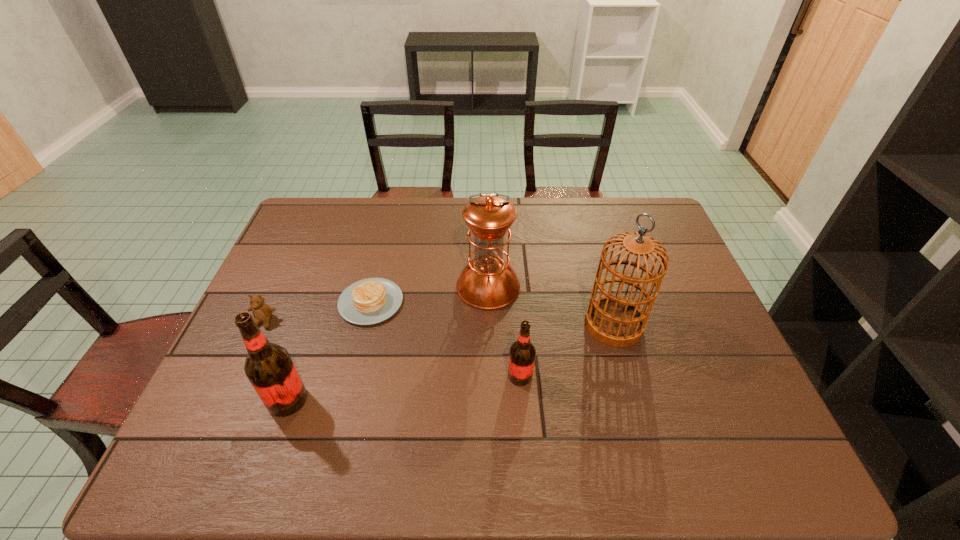
Identify the location of vacant space located on the back of the taller root beer. (330, 279).

The height and width of the screenshot is (540, 960). Identify the location of vacant point located 0.050m on the right of the right root beer. (553, 376).

The width and height of the screenshot is (960, 540). In order to click on blank space located on the back of the shortest object in this screenshot , I will do `click(389, 230)`.

This screenshot has width=960, height=540. I want to click on vacant space located on the front-facing side of the leftmost object, so click(245, 363).

This screenshot has width=960, height=540. I want to click on vacant space situated 0.190m on the left of the rightmost object, so click(516, 324).

Identify the location of vacant space located on the left of the oil lamp. (330, 286).

This screenshot has height=540, width=960. I want to click on object that is at the near edge, so click(268, 366).

Image resolution: width=960 pixels, height=540 pixels. Identify the location of root beer located in the left edge section of the desktop. (268, 366).

Where is `teddy bear present at the left edge`? The image size is (960, 540). teddy bear present at the left edge is located at coordinates (262, 312).

The width and height of the screenshot is (960, 540). What are the coordinates of `object situated at the near left corner` in the screenshot? It's located at [268, 366].